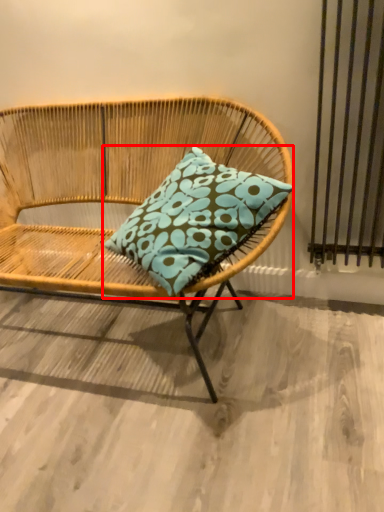
Question: Considering the relative positions of pillow (annotated by the red box) and chair in the image provided, where is pillow (annotated by the red box) located with respect to the staircase?

Choices:
 (A) right
 (B) left

Answer: (A)